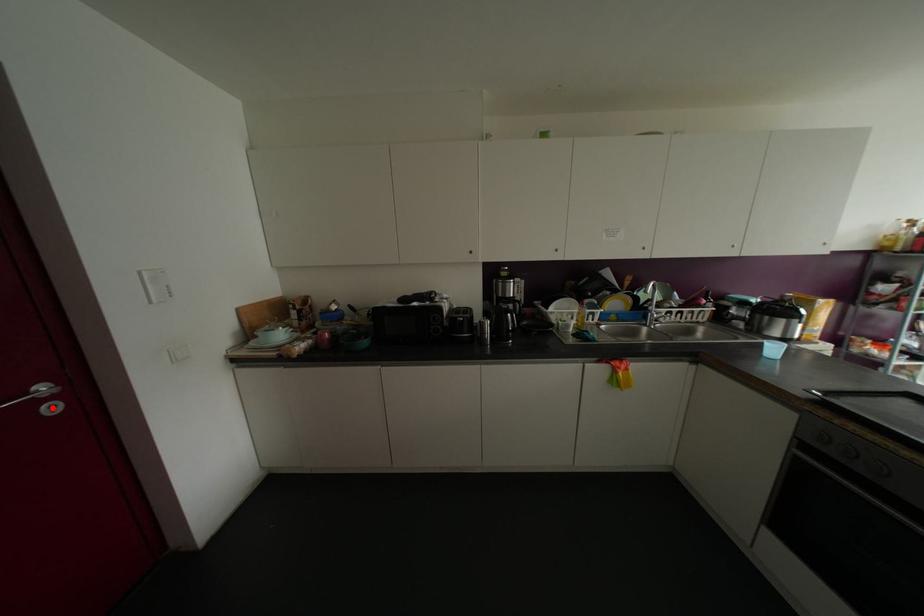
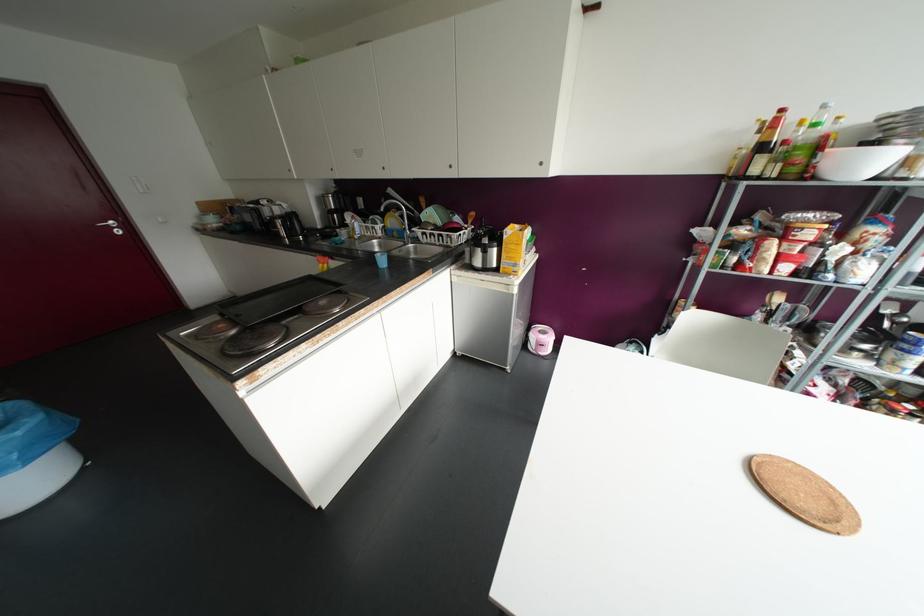
Find the pixel in the second image that matches the highlighted location in the first image.

(117, 232)